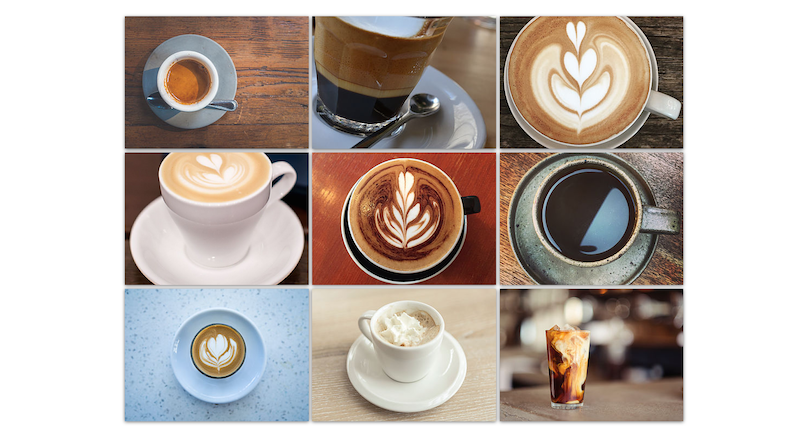
At what (x,y) coordinates should I click in order to perform the action: click on cups. Please return your answer as a coordinate pair (x, y). This screenshot has width=800, height=436. Looking at the image, I should click on (410, 361), (217, 375), (574, 381), (590, 240), (426, 243), (230, 204), (194, 85), (396, 57), (618, 95).